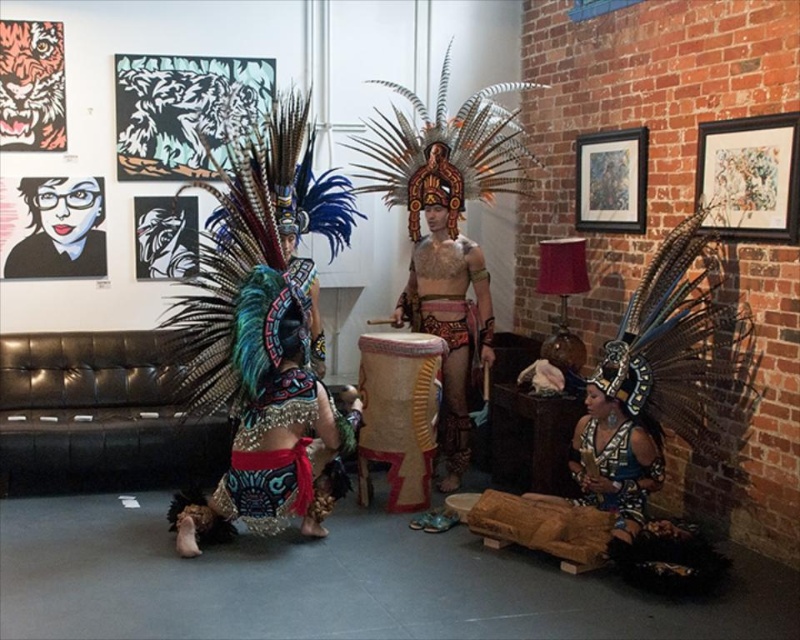
You are a photographer standing in the center of the art gallery. You want to take a photo of both the matte black headdress at lower right and the shiny blue fabric headdress at lower right. Given that your camera can capture a maximum width of 1.5 inches in its current setting, will both headdresses fit in the frame?

The distance between the matte black headdress at lower right and the shiny blue fabric headdress at lower right is 1.45 inches, which is less than the camera frame width of 1.5 inches. Therefore, both headdresses will fit within the frame.

In the scene shown: You are a photographer in the gallery and want to capture a closeup of the shiny blue fabric headdress at lower right without the matte black headdress at lower right blocking it. How should you adjust your camera position?

To avoid the matte black headdress at lower right blocking the shiny blue fabric headdress at lower right, you should position your camera below the matte black headdress at lower right since it is above the shiny blue fabric headdress at lower right.